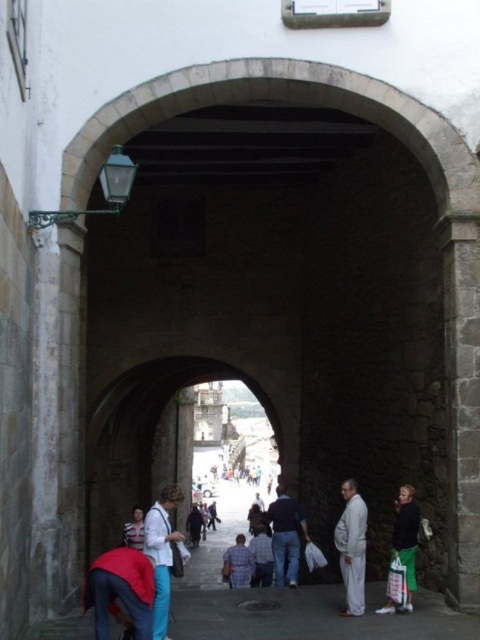
Does point (283, 560) lie in front of point (408, 516)?

No, (283, 560) is behind (408, 516).

Does dark blue jeans at center appear over dark green pants at lower right?

Actually, dark blue jeans at center is below dark green pants at lower right.

Locate an element on the screen. dark blue jeans at center is located at coordinates (286, 536).

Is red fabric pants at lower left above light blue jeans at center?

Yes, red fabric pants at lower left is above light blue jeans at center.

This screenshot has height=640, width=480. What do you see at coordinates (120, 589) in the screenshot? I see `red fabric pants at lower left` at bounding box center [120, 589].

Between point (113, 586) and point (162, 522), which one is positioned in front?

Point (113, 586) is in front.

You are a GUI agent. You are given a task and a screenshot of the screen. Output one action in this format:
    pyautogui.click(x=<x>, y=<y>)
    Task: Click on the red fabric pants at lower left
    
    Given the screenshot: What is the action you would take?
    pyautogui.click(x=120, y=589)

Between red fabric pants at lower left and dark green pants at lower right, which one has more height?

dark green pants at lower right

Can you confirm if red fabric pants at lower left is positioned to the right of dark green pants at lower right?

In fact, red fabric pants at lower left is to the left of dark green pants at lower right.

Which is behind, point (108, 600) or point (407, 508)?

Point (407, 508)

You are a GUI agent. You are given a task and a screenshot of the screen. Output one action in this format:
    pyautogui.click(x=<x>, y=<y>)
    Task: Click on the red fabric pants at lower left
    Image resolution: width=480 pixels, height=640 pixels.
    Given the screenshot: What is the action you would take?
    pyautogui.click(x=120, y=589)